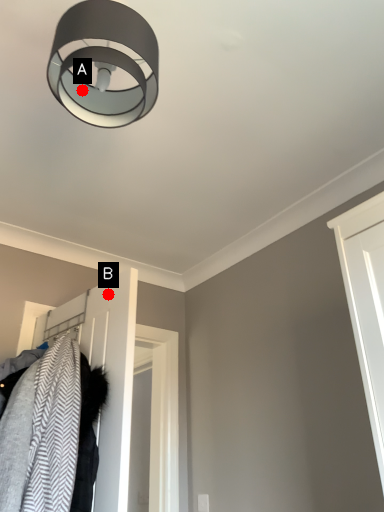
Question: Two points are circled on the image, labeled by A and B beside each circle. Which point is closer to the camera?

Choices:
 (A) A is closer
 (B) B is closer

Answer: (A)